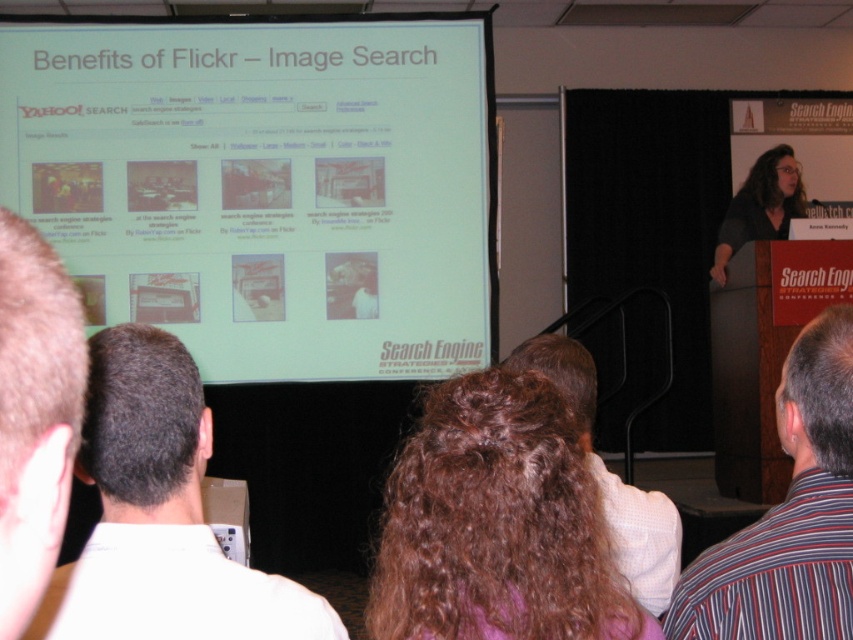
You are an attendee at the Search Engine Strategies Conference. You want to take a photo of the projection screen to capture the Yahoo! logo and the slide title. Based on your current position, can you estimate if the point marked at coordinates (264, 184) on the white matte projection screen at upper center will help you frame both the Yahoo! logo and the slide title in your camera viewfinder?

The white matte projection screen at upper center is represented by point (264, 184). Since the Yahoo! logo is at the top left and the slide title is centered, the point might be near the top left area of the screen. To frame both elements, ensure the camera is positioned to include the top left corner and the center of the screen. The exact framing depends on the camera angle and zoom, but the point could be a reference for alignment.

You are standing in the front row of the presentation. There are two points on the slide displayed on the screen. One is at coordinate point (x=395, y=76) and the other is at coordinate point (x=172, y=339). Which point is closer to you?

Point (x=172, y=339) is closer to you because it is nearer to the camera than point (x=395, y=76).